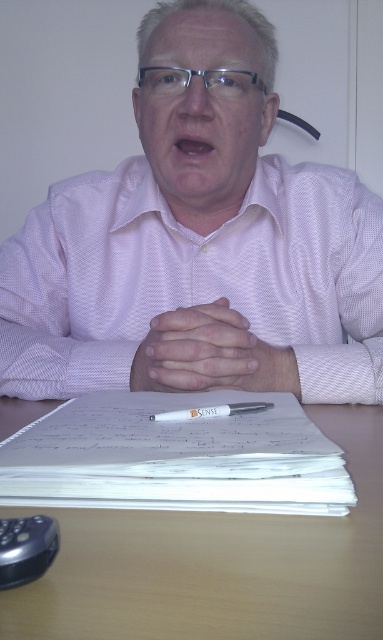
Question: Where is smooth skin hands at center located in relation to white plastic pen at center in the image?

Choices:
 (A) above
 (B) below

Answer: (A)

Question: Where is white paper at center located in relation to smooth skin hands at center in the image?

Choices:
 (A) below
 (B) above

Answer: (A)

Question: Considering the real-world distances, which object is closest to the clear plastic glasses at center?

Choices:
 (A) smooth skin hands at center
 (B) white plastic pen at center
 (C) white paper at center

Answer: (A)

Question: Which object appears farthest from the camera in this image?

Choices:
 (A) white plastic pen at center
 (B) pink textured shirt at center

Answer: (B)

Question: Is white paper at center wider than smooth skin hands at center?

Choices:
 (A) yes
 (B) no

Answer: (A)

Question: Which object appears closest to the camera in this image?

Choices:
 (A) clear plastic glasses at center
 (B) white paper at center

Answer: (B)